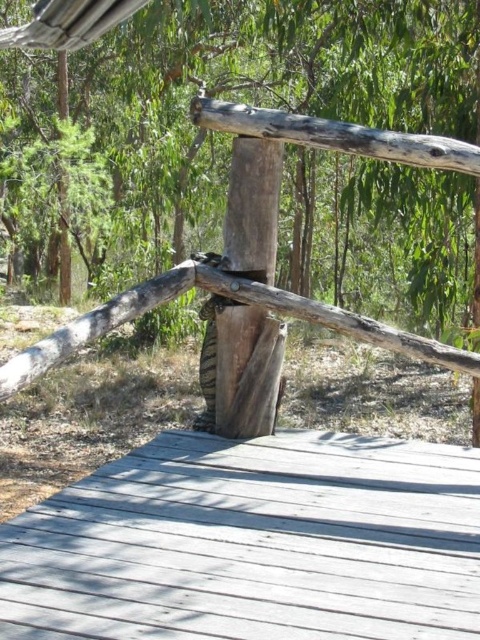
You are standing at the center of the wooden deck and want to place a small potted plant exactly at the point marked by coordinates point (x=252, y=544). Is this point located on the smooth gray wood deck at center?

Yes, the smooth gray wood deck at center is located at point (x=252, y=544), so placing the potted plant there would be on the deck.

You are standing on the smooth gray wood deck at center and want to reach the weathered wood post at center. In which direction should you move to get closer to the post?

You should move to the right to get closer to the weathered wood post at center because the smooth gray wood deck at center is to the left of it.

You are standing on the smooth gray wood deck at center and want to reach the weathered wood post at center. In which direction should you move to get closer to the post?

You should move upward to get closer to the weathered wood post at center because the smooth gray wood deck at center is below it.